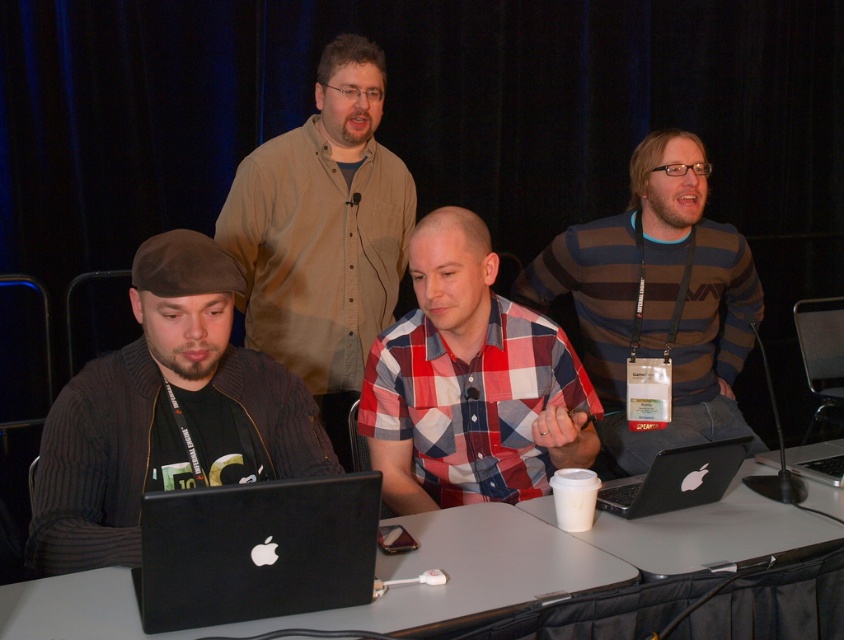
Consider the image. You are a photographer trying to capture a clear shot of the silver metallic laptop at center without the plaid cotton shirt at center blocking it. How should you adjust your camera angle?

The plaid cotton shirt at center is positioned over the silver metallic laptop at center, so to avoid blocking, you should lower your camera angle to look up towards the laptop beneath the shirt.